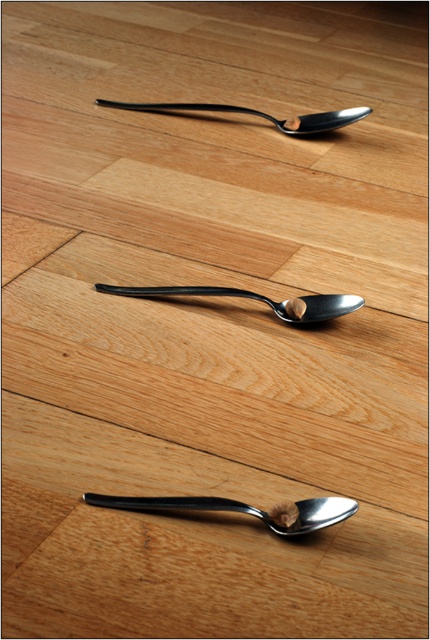
You are setting up a table for a formal dinner and need to arrange the satin black spoon at center and the polished metal spoon at upper center. The table has limited vertical space between the table top and the hanging fixture above. Which spoon should you place closer to the fixture to avoid it touching?

The satin black spoon at center is shorter than the polished metal spoon at upper center, so placing the satin black spoon at center closer to the fixture would be safer to prevent it from touching.

You are a chef arranging utensils on a wooden table. You have two polished metal spoons to place. The polished metal spoon at center needs to be positioned 4.35 feet away from the polished metal spoon at upper center. Can you confirm if the current arrangement meets this requirement?

The distance between the polished metal spoon at center and the polished metal spoon at upper center is exactly 4.35 feet, so the current arrangement meets the requirement.